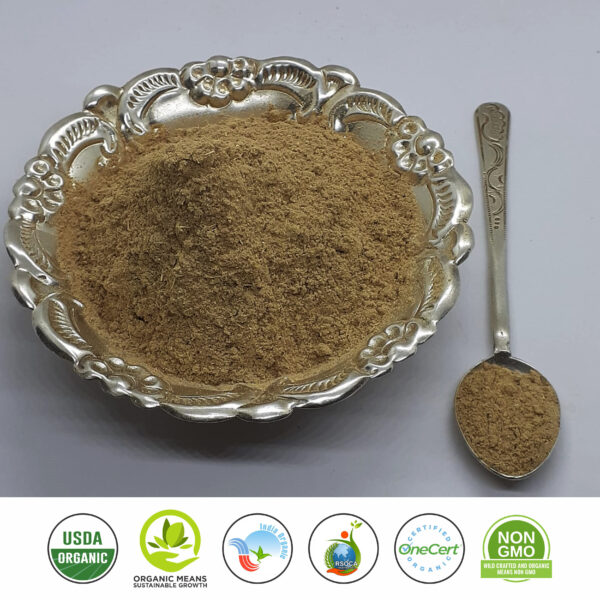
Identify the location of bowl. (223, 84).